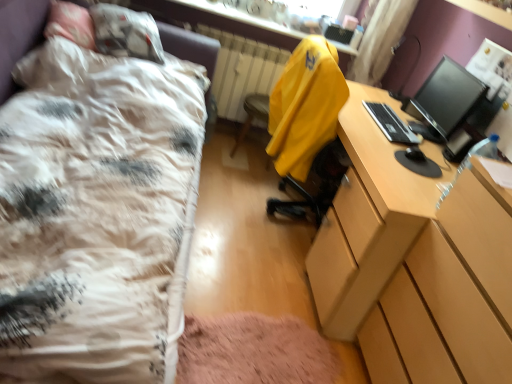
Image resolution: width=512 pixels, height=384 pixels. Describe the element at coordinates (380, 39) in the screenshot. I see `curtain at upper right` at that location.

You are a GUI agent. You are given a task and a screenshot of the screen. Output one action in this format:
    pyautogui.click(x=<x>, y=<y>)
    Task: Click on the yellow fabric jacket at center
    
    Given the screenshot: What is the action you would take?
    pyautogui.click(x=305, y=106)

Where is `curtain at upper right`? The width and height of the screenshot is (512, 384). curtain at upper right is located at coordinates (380, 39).

Does white striped radiator at center have a smaller size compared to white textured bed at left?

Correct, white striped radiator at center occupies less space than white textured bed at left.

From the image's perspective, which one is positioned lower, white striped radiator at center or white textured bed at left?

white textured bed at left, from the image's perspective.

From a real-world perspective, is white striped radiator at center below white textured bed at left?

Indeed, from a real-world perspective, white striped radiator at center is positioned beneath white textured bed at left.

Looking at this image, is white striped radiator at center positioned with its back to white textured bed at left?

No, white textured bed at left is not at the back of white striped radiator at center.

From the image's perspective, is white striped radiator at center located beneath yellow fabric computer chair at center?

Incorrect, from the image's perspective, white striped radiator at center is higher than yellow fabric computer chair at center.

Between white striped radiator at center and yellow fabric computer chair at center, which one has smaller size?

With smaller size is yellow fabric computer chair at center.

Is white striped radiator at center facing towards yellow fabric computer chair at center?

Yes, white striped radiator at center is facing yellow fabric computer chair at center.

How many degrees apart are the facing directions of white striped radiator at center and yellow fabric computer chair at center?

They differ by 2.77 degrees in their facing directions.

From a real-world perspective, which is physically below, white striped radiator at center or curtain at upper right?

white striped radiator at center, from a real-world perspective.

The image size is (512, 384). What are the coordinates of `curtain on the right side of white striped radiator at center` in the screenshot? It's located at (380, 39).

Is curtain at upper right at the back of white striped radiator at center?

No.

Do you think white striped radiator at center is within curtain at upper right, or outside of it?

white striped radiator at center exists outside the volume of curtain at upper right.

From a real-world perspective, is curtain at upper right physically above black plastic keyboard at right?

Yes, from a real-world perspective, curtain at upper right is above black plastic keyboard at right.

How many degrees apart are the facing directions of curtain at upper right and black plastic keyboard at right?

The angular difference between curtain at upper right and black plastic keyboard at right is 89.5 degrees.

Is curtain at upper right far away from black plastic keyboard at right?

They are positioned close to each other.

Considering the sizes of curtain at upper right and black plastic keyboard at right in the image, is curtain at upper right taller or shorter than black plastic keyboard at right?

curtain at upper right is taller than black plastic keyboard at right.

What's the angular difference between black glossy monitor at upper right and curtain at upper right's facing directions?

The facing directions of black glossy monitor at upper right and curtain at upper right are 89.4 degrees apart.

Is black glossy monitor at upper right taller than curtain at upper right?

No.

Does black glossy monitor at upper right turn towards curtain at upper right?

No, black glossy monitor at upper right is not aimed at curtain at upper right.

Locate an element on the screen. The height and width of the screenshot is (384, 512). curtain behind the black glossy monitor at upper right is located at coordinates (380, 39).

From the image's perspective, would you say wooden desk at right is shown under black glossy monitor at upper right?

Yes.

Is wooden desk at right not within black glossy monitor at upper right?

wooden desk at right lies outside black glossy monitor at upper right's area.

Considering the relative sizes of wooden desk at right and black glossy monitor at upper right in the image provided, is wooden desk at right bigger than black glossy monitor at upper right?

Indeed, wooden desk at right has a larger size compared to black glossy monitor at upper right.

Is curtain at upper right behind white striped radiator at center?

No, curtain at upper right is closer to the camera.

From the image's perspective, relative to white striped radiator at center, is curtain at upper right above or below?

From the image's perspective, curtain at upper right appears above white striped radiator at center.

From a real-world perspective, relative to white striped radiator at center, is curtain at upper right vertically above or below?

curtain at upper right is above white striped radiator at center.

Does curtain at upper right have a smaller size compared to white striped radiator at center?

Yes, curtain at upper right is smaller than white striped radiator at center.

The height and width of the screenshot is (384, 512). Find the location of `radiator behind the white textured bed at left`. radiator behind the white textured bed at left is located at coordinates click(x=242, y=70).

The image size is (512, 384). Find the location of `radiator that is above the yellow fabric computer chair at center (from the image's perspective)`. radiator that is above the yellow fabric computer chair at center (from the image's perspective) is located at coordinates (242, 70).

When comparing their distances from wooden desk at right, does yellow fabric computer chair at center or black glossy monitor at upper right seem further?

yellow fabric computer chair at center is positioned further to the anchor wooden desk at right.

Considering their positions, is yellow fabric jacket at center positioned further to black plastic keyboard at right than white striped radiator at center?

white striped radiator at center lies further to black plastic keyboard at right than the other object.

Looking at the image, which one is located closer to black glossy monitor at upper right, black plastic keyboard at right or white striped radiator at center?

black plastic keyboard at right lies closer to black glossy monitor at upper right than the other object.

When comparing their distances from white textured bed at left, does black plastic keyboard at right or yellow fabric computer chair at center seem closer?

Based on the image, black plastic keyboard at right appears to be nearer to white textured bed at left.

When comparing their distances from black plastic keyboard at right, does black glossy monitor at upper right or curtain at upper right seem closer?

black glossy monitor at upper right.

Considering their positions, is white textured bed at left positioned closer to black glossy monitor at upper right than yellow fabric jacket at center?

The object closer to black glossy monitor at upper right is yellow fabric jacket at center.

When comparing their distances from yellow fabric jacket at center, does black plastic keyboard at right or white textured bed at left seem further?

Based on the image, white textured bed at left appears to be further to yellow fabric jacket at center.

Considering their positions, is white textured bed at left positioned further to yellow fabric jacket at center than yellow fabric computer chair at center?

white textured bed at left is further to yellow fabric jacket at center.

Image resolution: width=512 pixels, height=384 pixels. I want to click on computer chair between white striped radiator at center and curtain at upper right from left to right, so click(252, 115).

Find the location of a particular element. The width and height of the screenshot is (512, 384). desktop between wooden desk at right and yellow fabric computer chair at center along the z-axis is located at coordinates (391, 124).

The width and height of the screenshot is (512, 384). I want to click on desktop situated between yellow fabric computer chair at center and curtain at upper right from left to right, so click(x=391, y=124).

The height and width of the screenshot is (384, 512). What are the coordinates of `jacket located between wooden desk at right and curtain at upper right in the depth direction` in the screenshot? It's located at (305, 106).